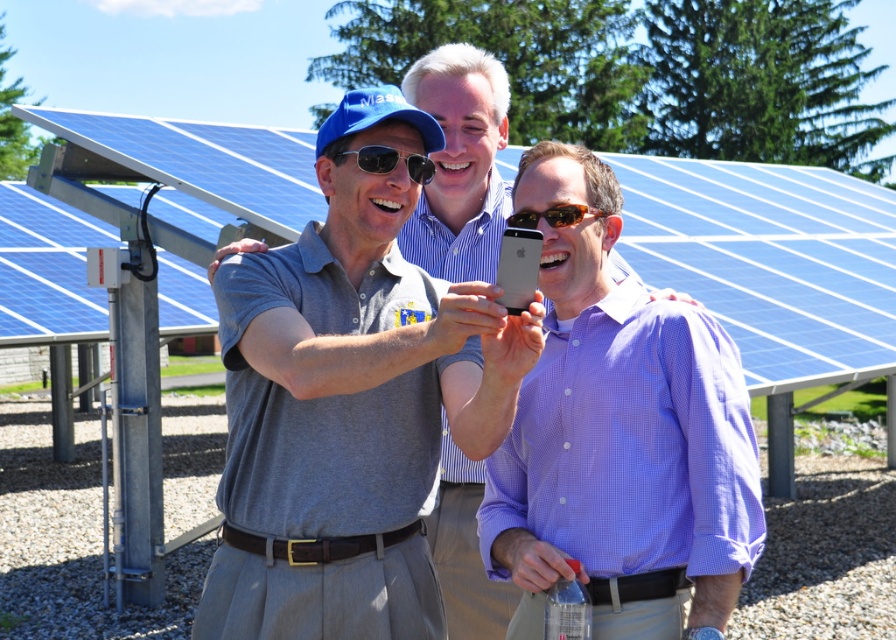
Is the position of matte gray shirt at center less distant than that of matte black sunglasses at center?

No, it is not.

Does matte gray shirt at center lie behind matte black sunglasses at center?

Yes, it is.

Which is in front, point (655, 292) or point (429, 164)?

Point (429, 164)

Image resolution: width=896 pixels, height=640 pixels. Identify the location of matte gray shirt at center. (459, 163).

Is purple checkered shirt at center to the left of matte gray shirt at center from the viewer's perspective?

Incorrect, purple checkered shirt at center is not on the left side of matte gray shirt at center.

What do you see at coordinates (619, 438) in the screenshot? I see `purple checkered shirt at center` at bounding box center [619, 438].

Who is more distant from viewer, (718,532) or (429,92)?

Positioned behind is point (429,92).

Identify the location of purple checkered shirt at center. This screenshot has width=896, height=640. (619, 438).

Can you confirm if purple checkered shirt at center is positioned below matte black sunglasses at center?

Correct, purple checkered shirt at center is located below matte black sunglasses at center.

Which of these two, purple checkered shirt at center or matte black sunglasses at center, stands taller?

purple checkered shirt at center is taller.

Is point (638, 497) closer to camera compared to point (372, 170)?

That is True.

You are a GUI agent. You are given a task and a screenshot of the screen. Output one action in this format:
    pyautogui.click(x=<x>, y=<y>)
    Task: Click on the purple checkered shirt at center
    This screenshot has width=896, height=640.
    Given the screenshot: What is the action you would take?
    pyautogui.click(x=619, y=438)